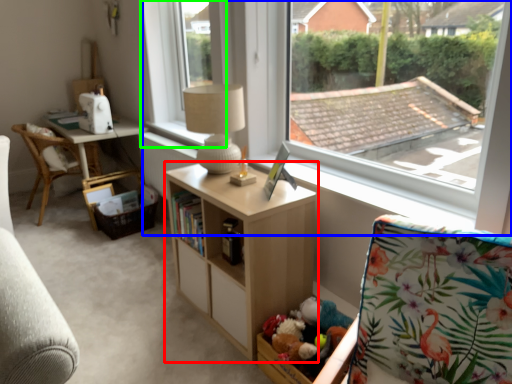
Question: Considering the real-world distances, which object is farthest from shelf (highlighted by a red box)? window (highlighted by a blue box) or window frame (highlighted by a green box)?

Choices:
 (A) window
 (B) window frame

Answer: (B)